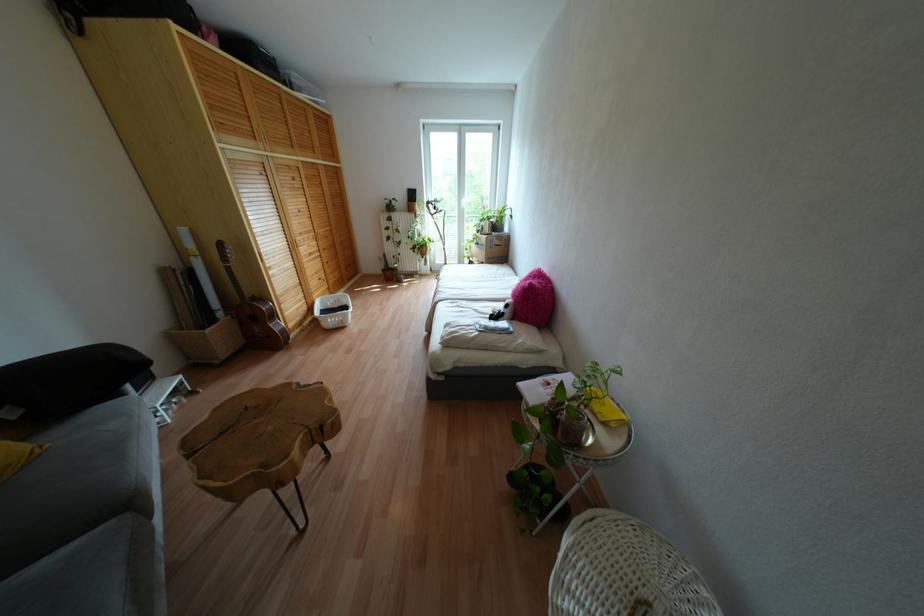
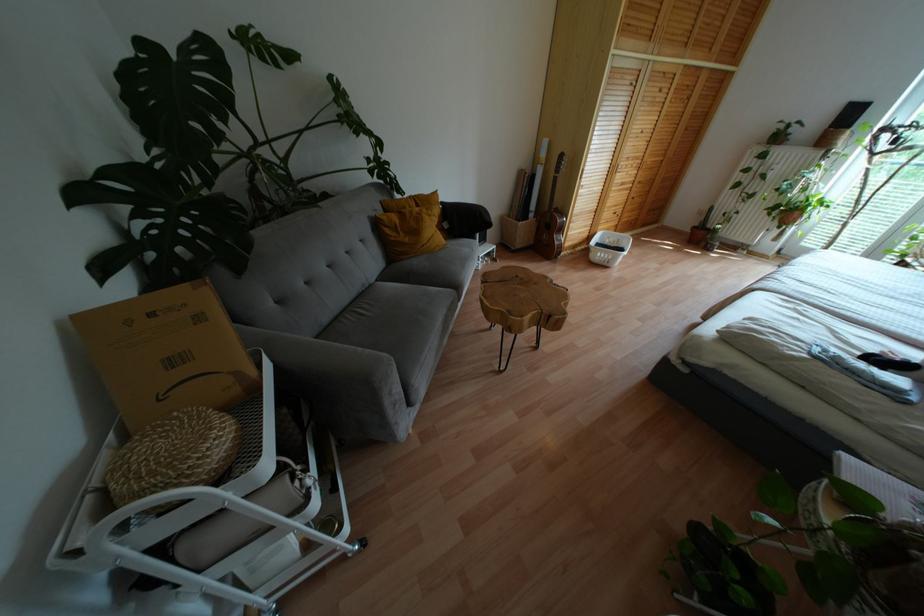
In the second image, find the point that corresponds to (383,270) in the first image.

(694, 227)